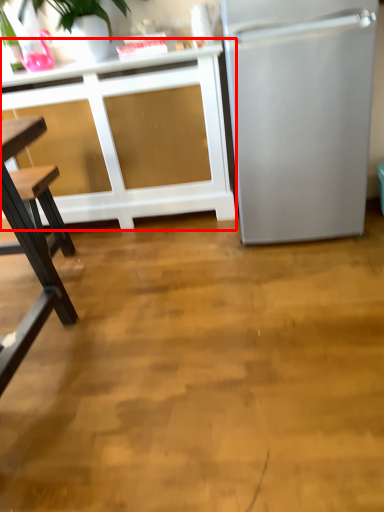
Question: From the image's perspective, considering the relative positions of cabinetry (annotated by the red box) and refrigerator in the image provided, where is cabinetry (annotated by the red box) located with respect to the staircase?

Choices:
 (A) below
 (B) above

Answer: (A)